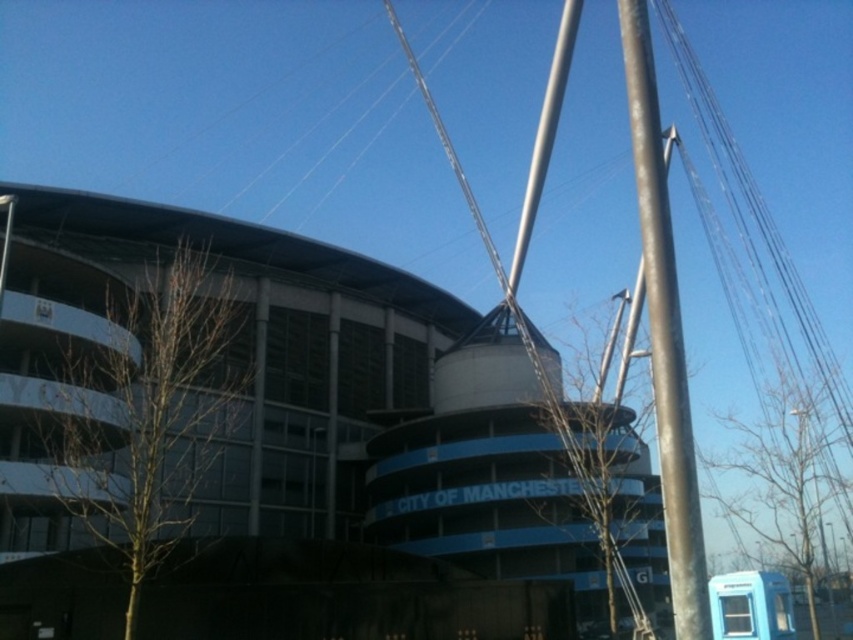
You are standing at the point marked as point (282, 520) in the image. You want to walk directly towards the viewer. How far will you have to walk to reach the viewer?

The distance between point (282, 520) and the viewer is 42.48 meters, so you will have to walk 42.48 meters to reach the viewer.

You are standing at the base of the stadium structure and see two points marked in the image. The first point is at coordinate point(x=277, y=305) and the second is at point(x=654, y=92). Which point is closer to you?

Point(x=654, y=92) is closer to you because it is in front of point(x=277, y=305).

Based on the photo, you are a delivery drone that needs to fly from the white concrete stadium at center to the blue plastic bus stop at lower right. What is the minimum horizontal distance you must cover to reach your destination?

The white concrete stadium at center and blue plastic bus stop at lower right are 22.42 meters apart from each other, so the minimum horizontal distance you must cover is 22.42 meters.